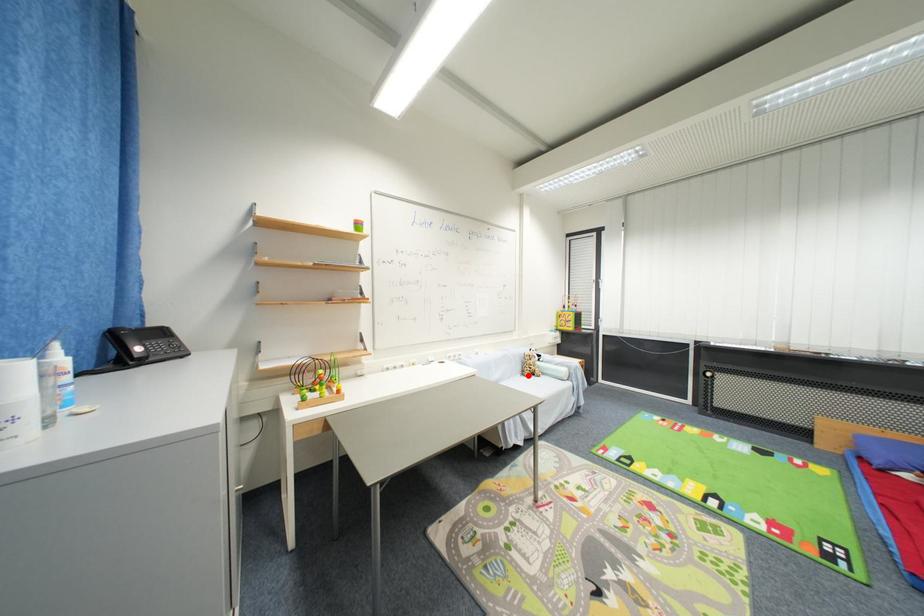
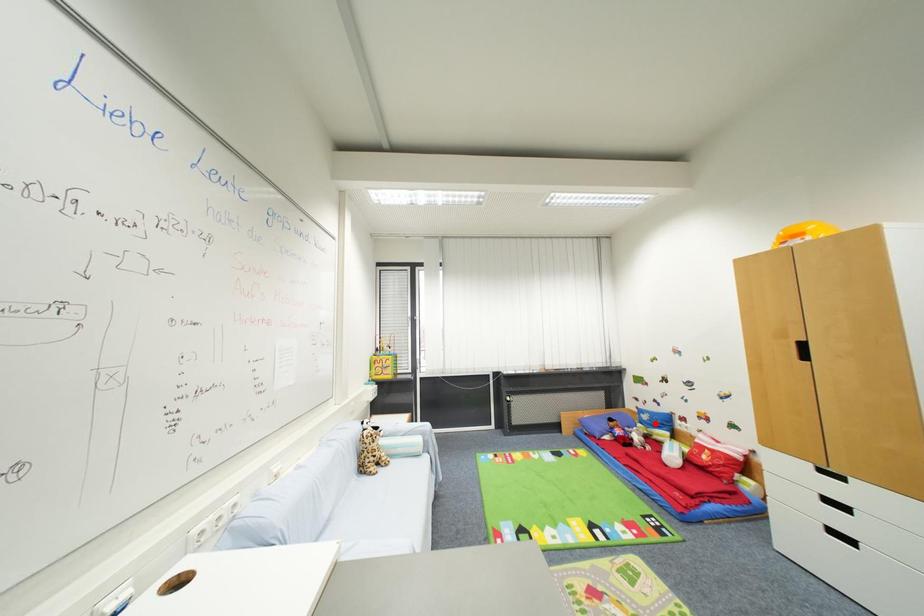
I am providing you with two images of the same scene from different viewpoints. A red point is marked on the first image and another point is marked on the second image. Does the point marked in image1 correspond to the same location as the one in image2?

No